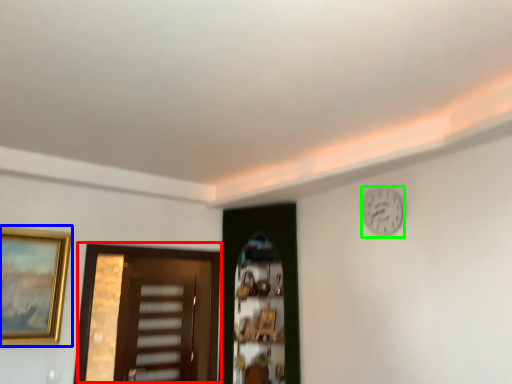
Question: Which is nearer to the door (highlighted by a red box)? picture frame (highlighted by a blue box) or clock (highlighted by a green box).

Choices:
 (A) picture frame
 (B) clock

Answer: (A)